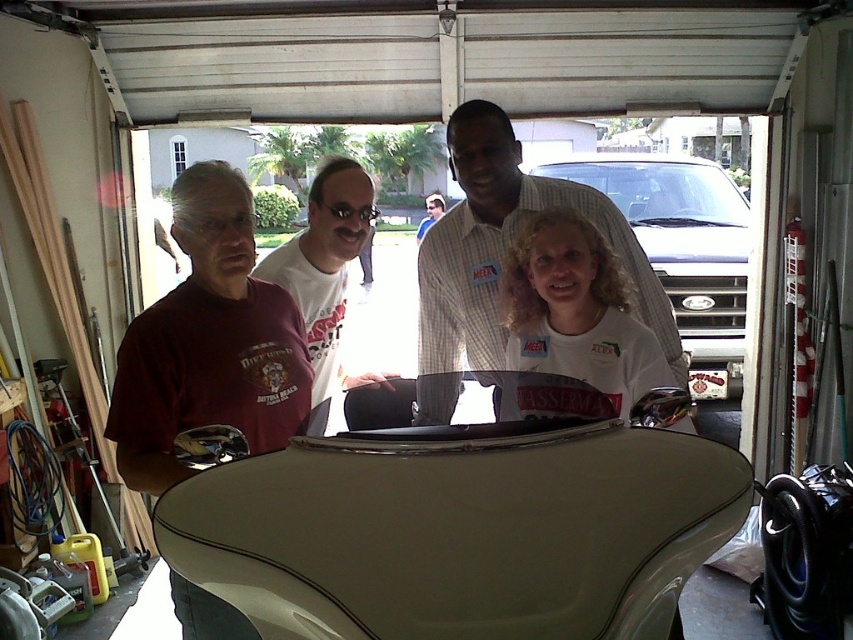
Question: Which object is positioned farthest from the light beige leather convertible at center?

Choices:
 (A) white matte car at center
 (B) white t-shirt at center

Answer: (A)

Question: Can you confirm if white t-shirt at center is thinner than matte white shirt at center?

Choices:
 (A) yes
 (B) no

Answer: (A)

Question: Is light beige leather convertible at center below white t-shirt at center?

Choices:
 (A) no
 (B) yes

Answer: (B)

Question: Considering the real-world distances, which object is farthest from the white matte shirt at center?

Choices:
 (A) matte white shirt at center
 (B) light beige leather convertible at center

Answer: (A)

Question: Estimate the real-world distances between objects in this image. Which object is farther from the white matte shirt at center?

Choices:
 (A) light beige leather convertible at center
 (B) white t-shirt at center
 (C) white matte car at center

Answer: (C)

Question: Does white matte shirt at center have a greater width compared to matte white shirt at center?

Choices:
 (A) no
 (B) yes

Answer: (A)